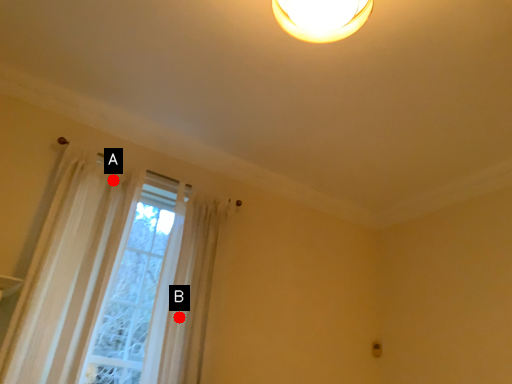
Question: Two points are circled on the image, labeled by A and B beside each circle. Which of the following is the closest to the observer?

Choices:
 (A) A is closer
 (B) B is closer

Answer: (B)